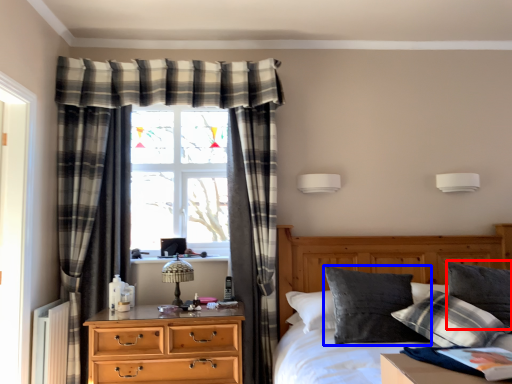
Question: Which object is closer to the camera taking this photo, pillow (highlighted by a red box) or pillow (highlighted by a blue box)?

Choices:
 (A) pillow
 (B) pillow

Answer: (B)